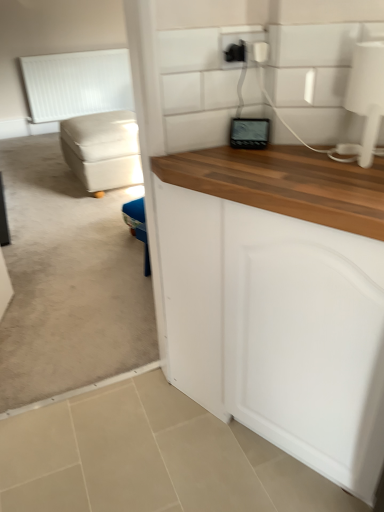
Question: Can you confirm if white matte radiator at upper left is positioned to the right of beige fabric ottoman at left?

Choices:
 (A) no
 (B) yes

Answer: (A)

Question: Does white matte radiator at upper left come in front of beige fabric ottoman at left?

Choices:
 (A) no
 (B) yes

Answer: (A)

Question: Does white matte radiator at upper left have a smaller size compared to beige fabric ottoman at left?

Choices:
 (A) no
 (B) yes

Answer: (B)

Question: Is white matte radiator at upper left facing away from beige fabric ottoman at left?

Choices:
 (A) no
 (B) yes

Answer: (A)

Question: Does white matte radiator at upper left turn towards beige fabric ottoman at left?

Choices:
 (A) no
 (B) yes

Answer: (B)

Question: Considering the positions of point (233, 42) and point (107, 67), is point (233, 42) closer or farther from the camera than point (107, 67)?

Choices:
 (A) closer
 (B) farther

Answer: (A)

Question: Do you think black plastic outlet at upper center is within white matte radiator at upper left, or outside of it?

Choices:
 (A) outside
 (B) inside

Answer: (A)

Question: Considering the positions of black plastic outlet at upper center and white matte radiator at upper left in the image, is black plastic outlet at upper center taller or shorter than white matte radiator at upper left?

Choices:
 (A) tall
 (B) short

Answer: (B)

Question: Considering the relative positions of black plastic outlet at upper center and white matte radiator at upper left in the image provided, is black plastic outlet at upper center to the left or to the right of white matte radiator at upper left?

Choices:
 (A) left
 (B) right

Answer: (B)

Question: In the image, is white matte radiator at upper left positioned in front of or behind black plastic outlet at upper center?

Choices:
 (A) front
 (B) behind

Answer: (B)

Question: Is white matte radiator at upper left situated inside black plastic outlet at upper center or outside?

Choices:
 (A) inside
 (B) outside

Answer: (B)

Question: From a real-world perspective, is white matte radiator at upper left physically located above or below black plastic outlet at upper center?

Choices:
 (A) below
 (B) above

Answer: (A)

Question: In the image, is white matte radiator at upper left on the left side or the right side of black plastic outlet at upper center?

Choices:
 (A) right
 (B) left

Answer: (B)

Question: Is beige fabric ottoman at left bigger or smaller than black plastic outlet at upper center?

Choices:
 (A) big
 (B) small

Answer: (A)

Question: Is point (122, 118) positioned closer to the camera than point (235, 53)?

Choices:
 (A) farther
 (B) closer

Answer: (A)